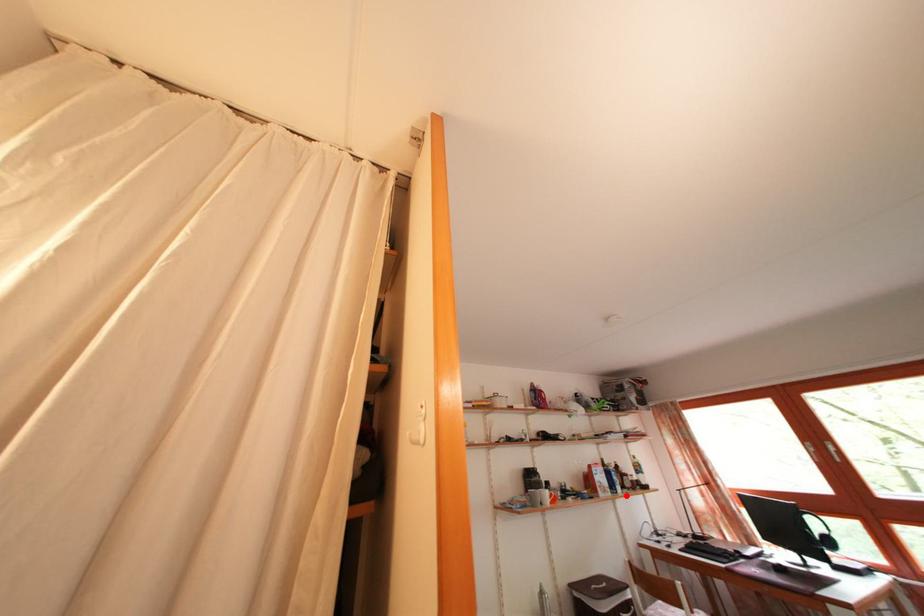
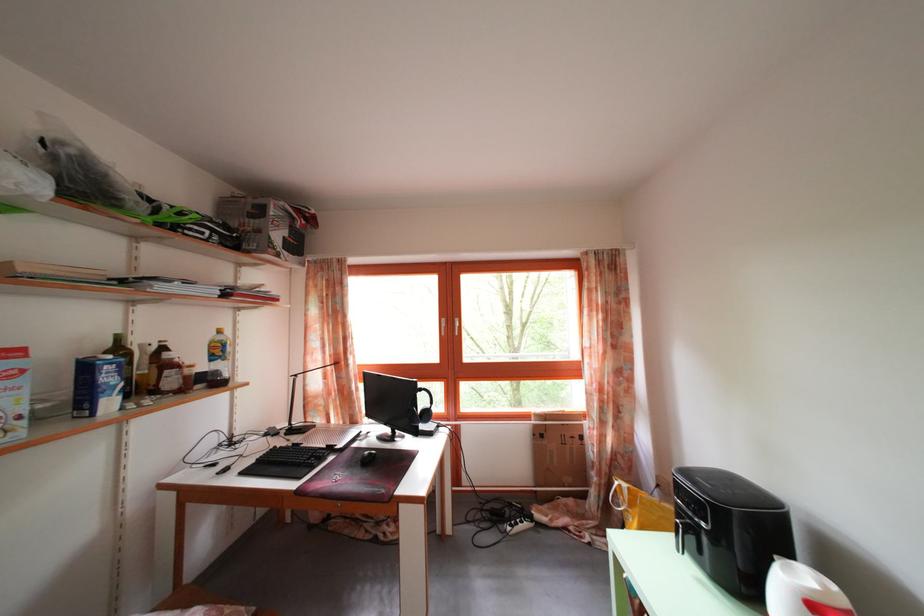
Where in the second image is the point corresponding to the highlighted location from the first image?

(117, 410)